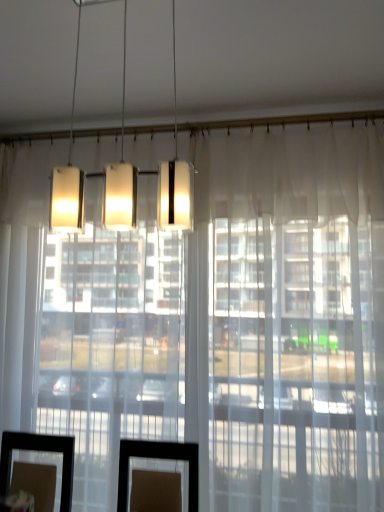
Question: Is matte white rectangular light fixture at upper center bigger or smaller than transparent glass door at center, the first glass door from the left?

Choices:
 (A) big
 (B) small

Answer: (B)

Question: Considering the positions of matte white rectangular light fixture at upper center and transparent glass door at center, the first glass door from the left, in the image, is matte white rectangular light fixture at upper center wider or thinner than transparent glass door at center, the first glass door from the left,?

Choices:
 (A) thin
 (B) wide

Answer: (A)

Question: Which object is the closest to the transparent glass door at center, the first glass door from the left?

Choices:
 (A) matte white rectangular light fixture at upper center
 (B) transparent glass door at center, which appears as the 1th glass door when viewed from the right

Answer: (B)

Question: Based on their relative distances, which object is farther from the transparent glass door at center, which appears as the 1th glass door when viewed from the right?

Choices:
 (A) matte white rectangular light fixture at upper center
 (B) transparent glass door at center, which is the second glass door from right to left

Answer: (A)